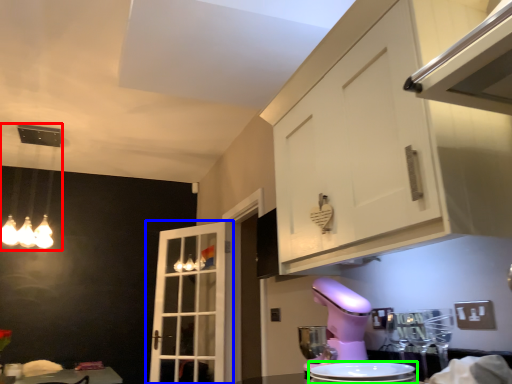
Question: Which is nearer to the light fixture (highlighted by a red box)? door (highlighted by a blue box) or appliance (highlighted by a green box).

Choices:
 (A) door
 (B) appliance

Answer: (A)